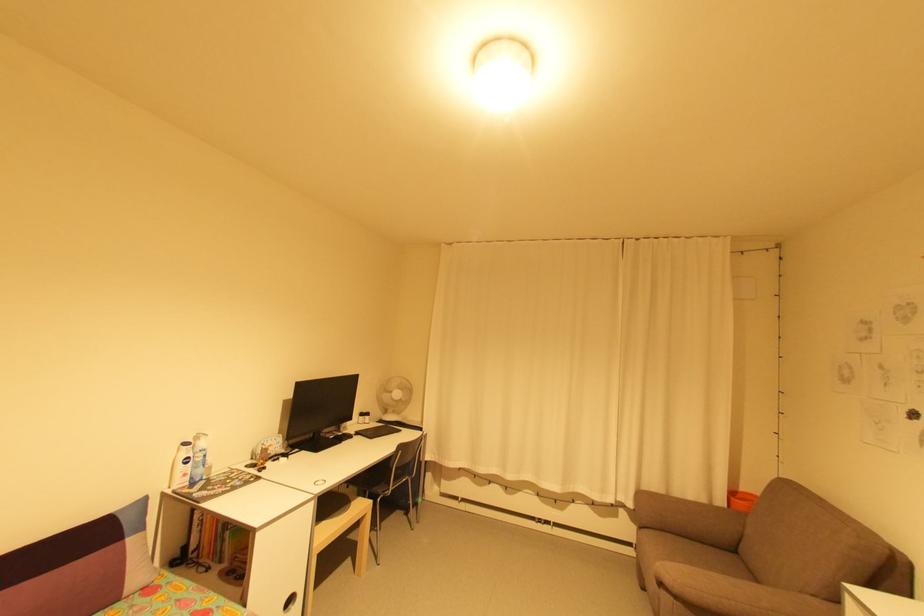
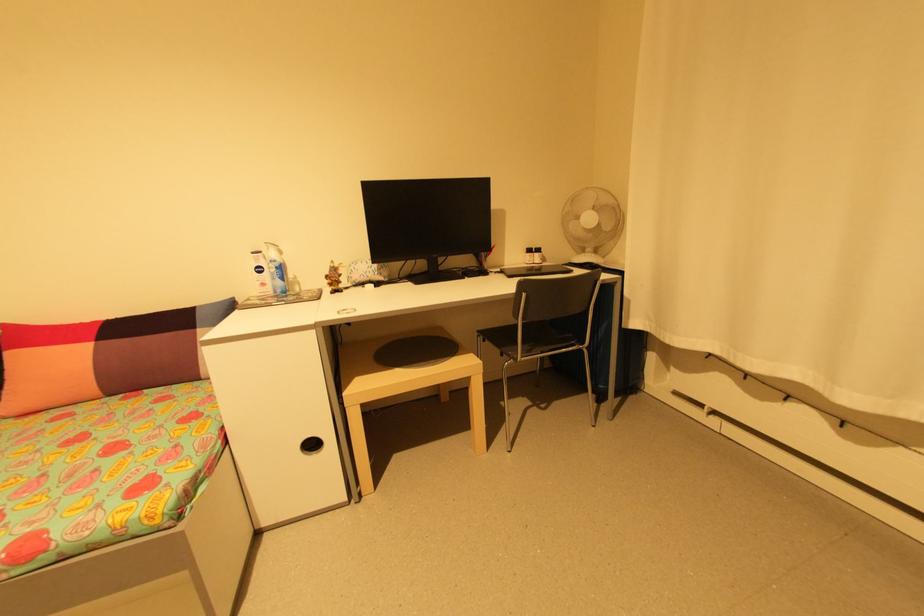
Find the pixel in the second image that matches (x=308, y=451) in the first image.

(414, 283)